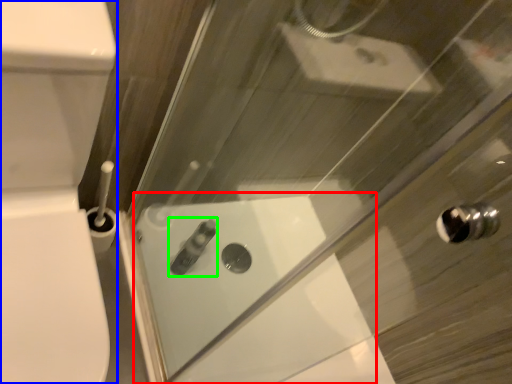
Question: Which object is the farthest from bath (highlighted by a red box)? Choose among these: porcelain (highlighted by a blue box) or toiletry (highlighted by a green box).

Choices:
 (A) porcelain
 (B) toiletry

Answer: (A)